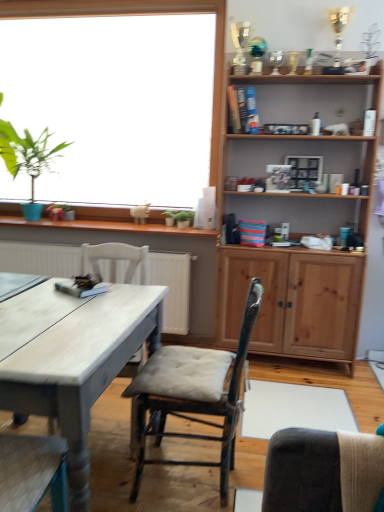
Question: Should I look upward or downward to see green leafy plant at upper left?

Choices:
 (A) up
 (B) down

Answer: (A)

Question: Is wooden cabinet at upper right smaller than green leafy plant at upper left?

Choices:
 (A) yes
 (B) no

Answer: (B)

Question: Does wooden cabinet at upper right have a greater width compared to green leafy plant at upper left?

Choices:
 (A) yes
 (B) no

Answer: (B)

Question: Is the depth of wooden cabinet at upper right less than that of green leafy plant at upper left?

Choices:
 (A) yes
 (B) no

Answer: (A)

Question: From a real-world perspective, is wooden cabinet at upper right located higher than green leafy plant at upper left?

Choices:
 (A) yes
 (B) no

Answer: (B)

Question: Considering the relative positions of wooden cabinet at upper right and green leafy plant at upper left in the image provided, is wooden cabinet at upper right to the left of green leafy plant at upper left from the viewer's perspective?

Choices:
 (A) yes
 (B) no

Answer: (B)

Question: Could you tell me if wooden cabinet at upper right is turned towards green leafy plant at upper left?

Choices:
 (A) yes
 (B) no

Answer: (B)

Question: Does wooden cushioned chair at center, which is the 1th chair in right-to-left order, have a lesser height compared to white wood chair at left, placed as the second chair when sorted from right to left?

Choices:
 (A) yes
 (B) no

Answer: (B)

Question: Is wooden cushioned chair at center, which is the 1th chair in right-to-left order, not within white wood chair at left, which is the first chair in left-to-right order?

Choices:
 (A) no
 (B) yes

Answer: (B)

Question: Are wooden cushioned chair at center, which is the 1th chair in right-to-left order, and white wood chair at left, which is the first chair in left-to-right order, far apart?

Choices:
 (A) yes
 (B) no

Answer: (B)

Question: Is wooden cushioned chair at center, positioned as the 2th chair in left-to-right order, thinner than white wood chair at left, placed as the second chair when sorted from right to left?

Choices:
 (A) yes
 (B) no

Answer: (A)

Question: Is wooden cushioned chair at center, positioned as the 2th chair in left-to-right order, oriented towards white wood chair at left, placed as the second chair when sorted from right to left?

Choices:
 (A) yes
 (B) no

Answer: (B)

Question: From the image's perspective, would you say wooden cushioned chair at center, positioned as the 2th chair in left-to-right order, is shown under white wood chair at left, placed as the second chair when sorted from right to left?

Choices:
 (A) yes
 (B) no

Answer: (A)

Question: Can you confirm if green leafy plant at upper left is bigger than wooden cabinet at upper right?

Choices:
 (A) no
 (B) yes

Answer: (A)